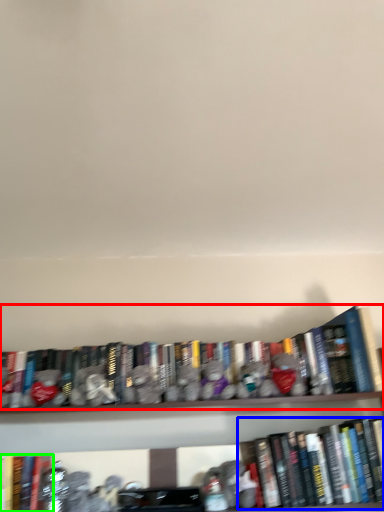
Question: Estimate the real-world distances between objects in this image. Which object is farther from book (highlighted by a red box), book (highlighted by a blue box) or book (highlighted by a green box)?

Choices:
 (A) book
 (B) book

Answer: (B)